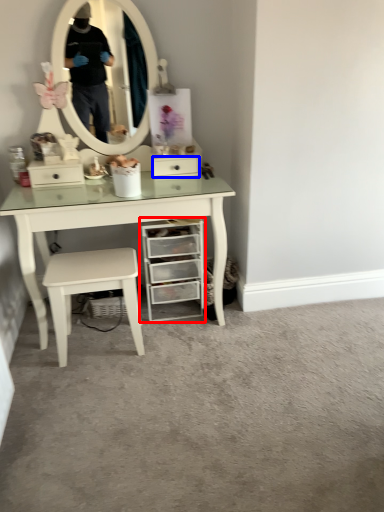
Question: Which object appears farthest to the camera in this image, chest of drawers (highlighted by a red box) or drawer (highlighted by a blue box)?

Choices:
 (A) chest of drawers
 (B) drawer

Answer: (B)